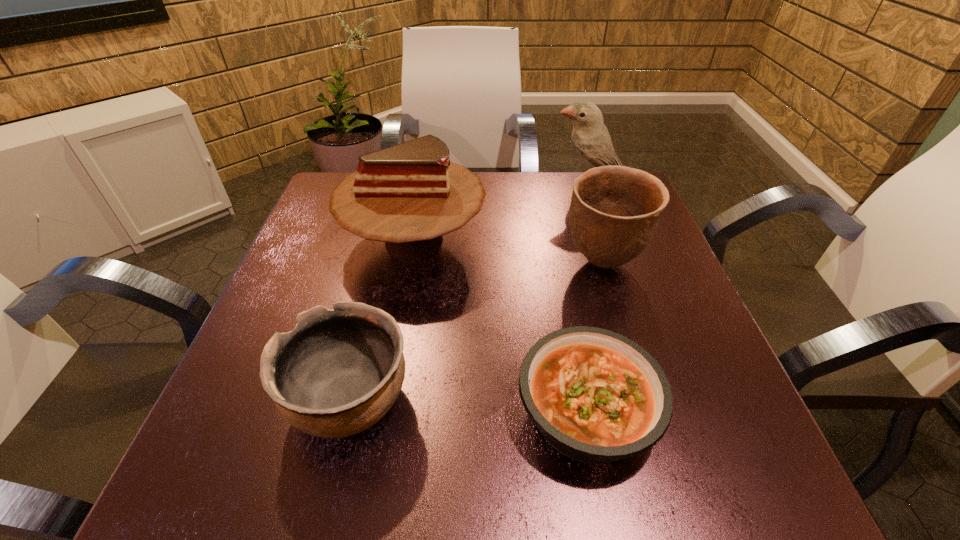
Locate an element on the screen. Image resolution: width=960 pixels, height=540 pixels. vacant area in the image that satisfies the following two spatial constraints: 1. at the face of the bird; 2. on the front side of the shortest object is located at coordinates (663, 411).

Identify the location of vacant area in the image that satisfies the following two spatial constraints: 1. on the front side of the nearer pottery; 2. on the right side of the shortest object. (348, 411).

Locate an element on the screen. This screenshot has width=960, height=540. free space that satisfies the following two spatial constraints: 1. at the face of the farthest object; 2. on the front side of the shorter pottery is located at coordinates (660, 401).